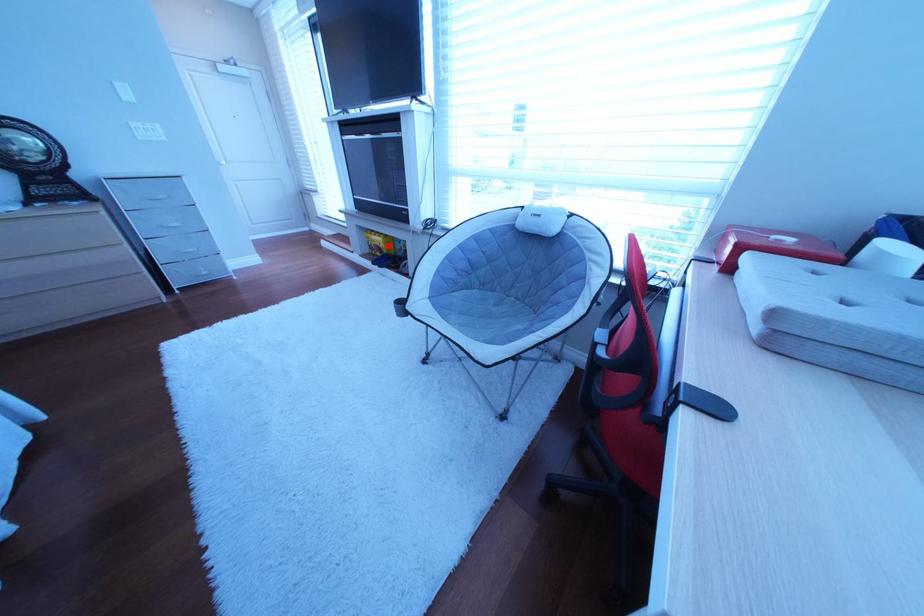
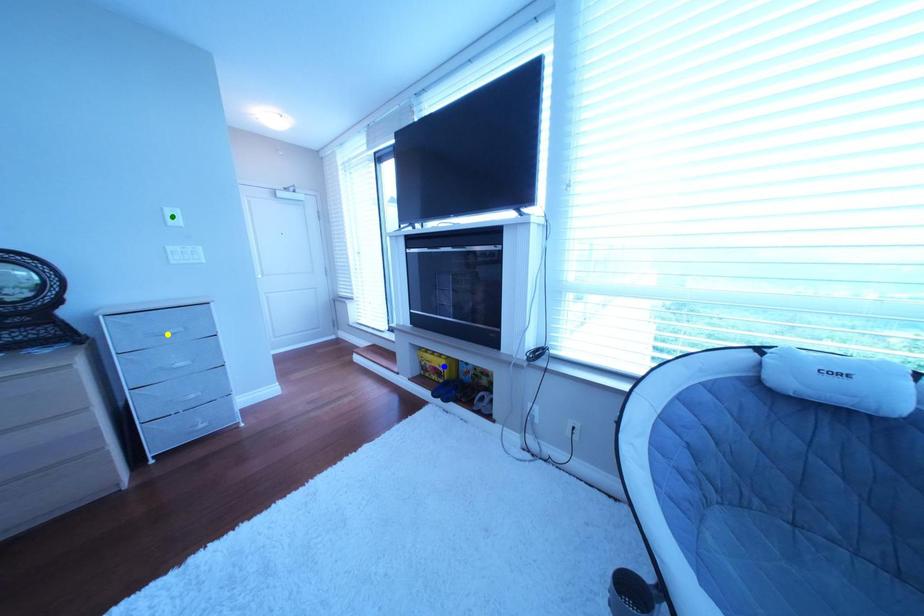
Question: I am providing you with two images of the same scene from different viewpoints. A red point is marked on the first image. You are given multiple points on the second image. Which spot in image 2 lines up with the point in image 1?

Choices:
 (A) green point
 (B) blue point
 (C) yellow point

Answer: (B)